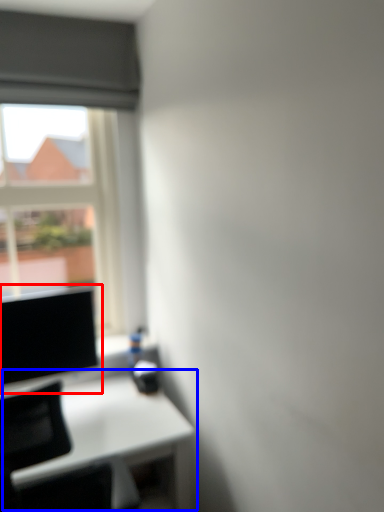
Question: Which of the following is the farthest to the observer, computer screen (highlighted by a red box) or table (highlighted by a blue box)?

Choices:
 (A) computer screen
 (B) table

Answer: (A)